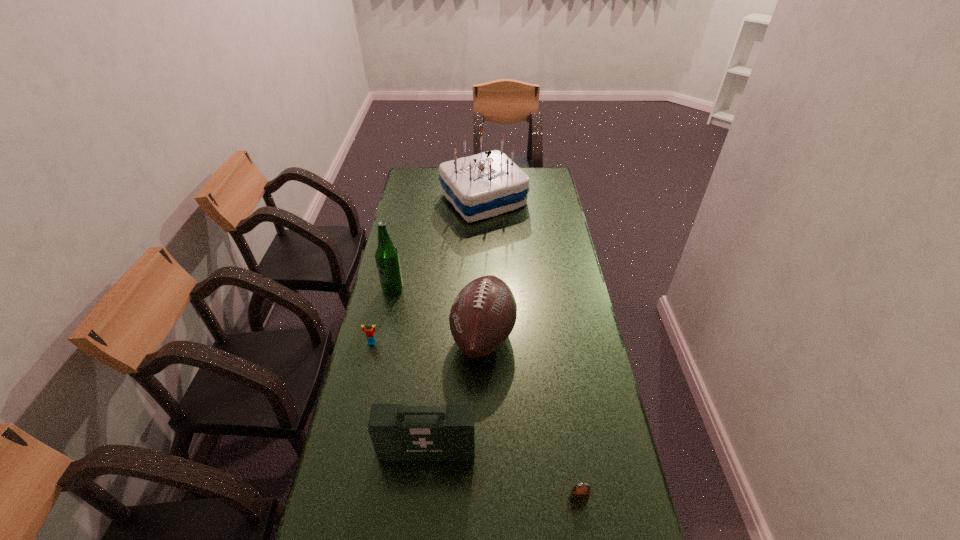
Locate an element on the screen. This screenshot has height=540, width=960. vacant position located 0.130m on the face of the Lego is located at coordinates (364, 378).

I want to click on object that is at the far edge, so click(x=487, y=184).

Image resolution: width=960 pixels, height=540 pixels. I want to click on beer bottle that is at the left edge, so point(387,256).

Find the location of a particular element. the first-aid kit positioned at the left edge is located at coordinates (398, 433).

Identify the location of Lego that is at the left edge. The width and height of the screenshot is (960, 540). point(370,334).

Identify the location of birthday cake that is at the right edge. The image size is (960, 540). (487, 184).

Locate an element on the screen. Image resolution: width=960 pixels, height=540 pixels. padlock positioned at the right edge is located at coordinates (578, 494).

The image size is (960, 540). What are the coordinates of `object present at the far right corner` in the screenshot? It's located at (487, 184).

Find the location of `vacant region at the left edge of the desktop`. vacant region at the left edge of the desktop is located at coordinates (400, 246).

The image size is (960, 540). In the image, there is a desktop. Identify the location of vacant space at the right edge. (545, 271).